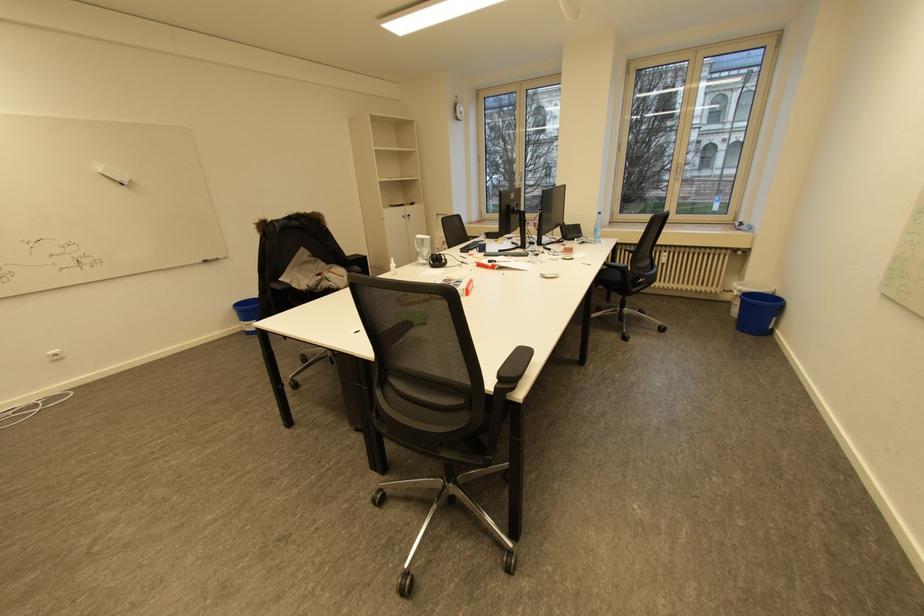
This screenshot has height=616, width=924. What do you see at coordinates (114, 175) in the screenshot? I see `the whiteboard eraser` at bounding box center [114, 175].